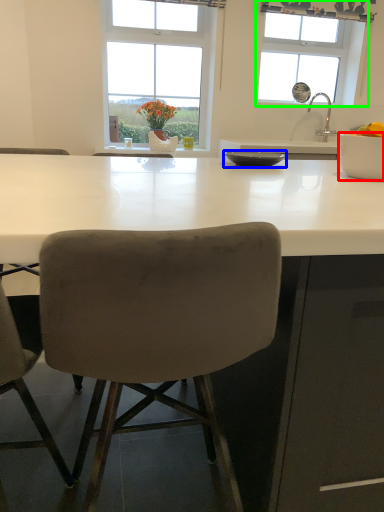
Question: Estimate the real-world distances between objects in this image. Which object is closer to bowl (highlighted by a red box), bowl (highlighted by a blue box) or window (highlighted by a green box)?

Choices:
 (A) bowl
 (B) window

Answer: (A)